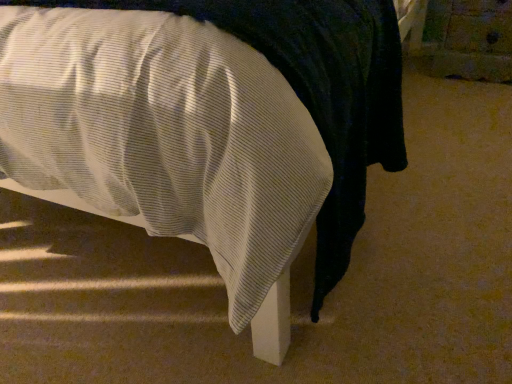
What are the coordinates of `wooden drawer at lower right` in the screenshot? It's located at (473, 40).

What do you see at coordinates (473, 40) in the screenshot?
I see `wooden drawer at lower right` at bounding box center [473, 40].

I want to click on wooden drawer at lower right, so click(473, 40).